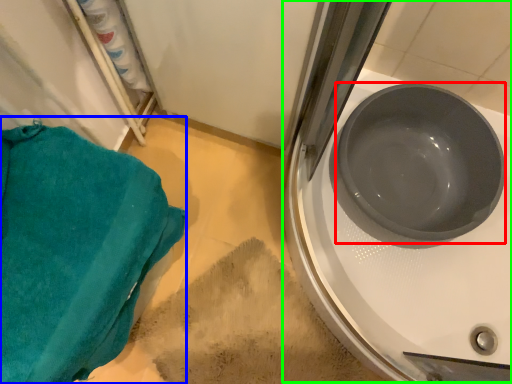
Question: Which object is the closest to the basin (highlighted by a red box)? Choose among these: towel/napkin (highlighted by a blue box) or sink (highlighted by a green box).

Choices:
 (A) towel/napkin
 (B) sink

Answer: (B)